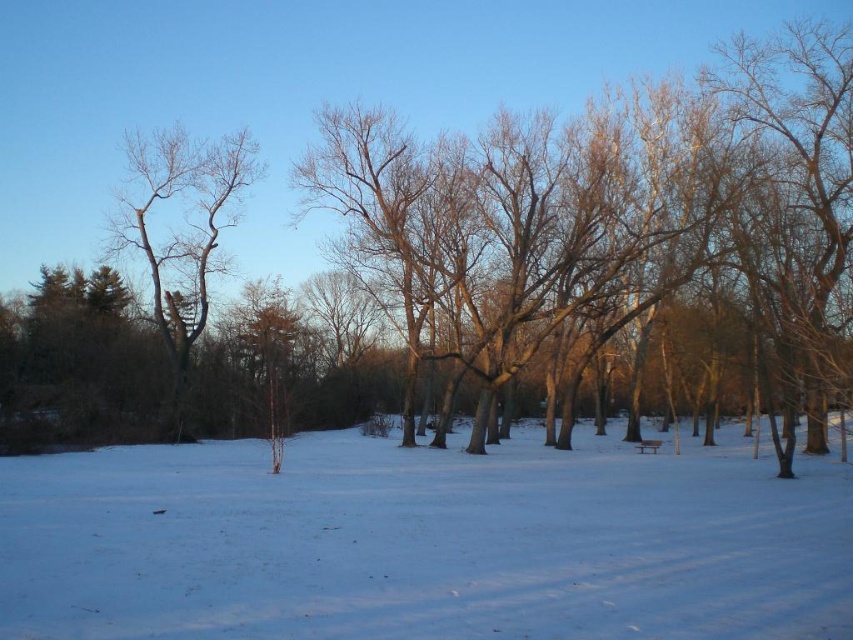
Question: Is white powdery snow at center below bare branches at left?

Choices:
 (A) yes
 (B) no

Answer: (A)

Question: Which point is farther to the camera?

Choices:
 (A) (775, 525)
 (B) (218, 172)

Answer: (B)

Question: Among these objects, which one is nearest to the camera?

Choices:
 (A) white powdery snow at center
 (B) bare branches at left

Answer: (A)

Question: From the image, what is the correct spatial relationship of white powdery snow at center in relation to bare branches at left?

Choices:
 (A) left
 (B) right

Answer: (B)

Question: Is white powdery snow at center to the left of bare branches at left from the viewer's perspective?

Choices:
 (A) no
 (B) yes

Answer: (A)